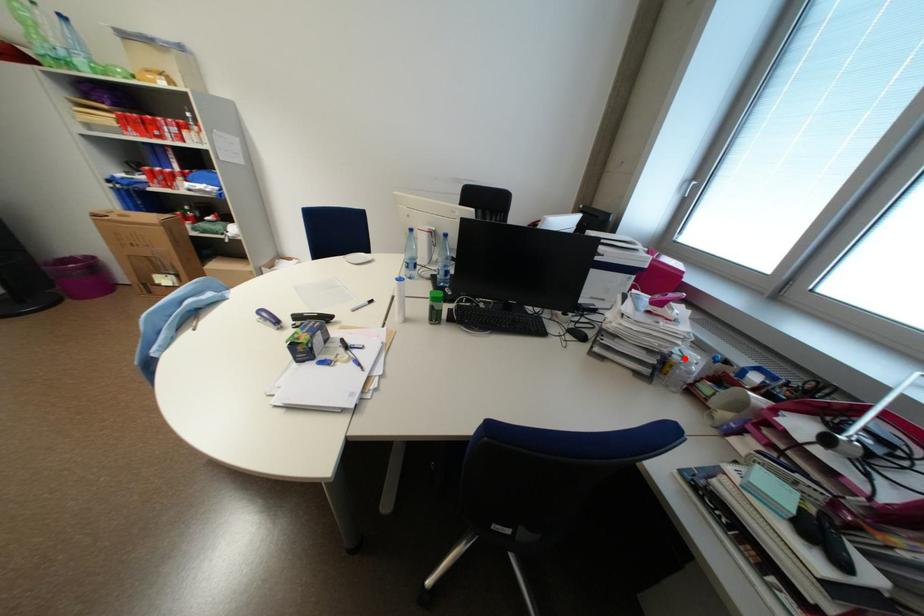
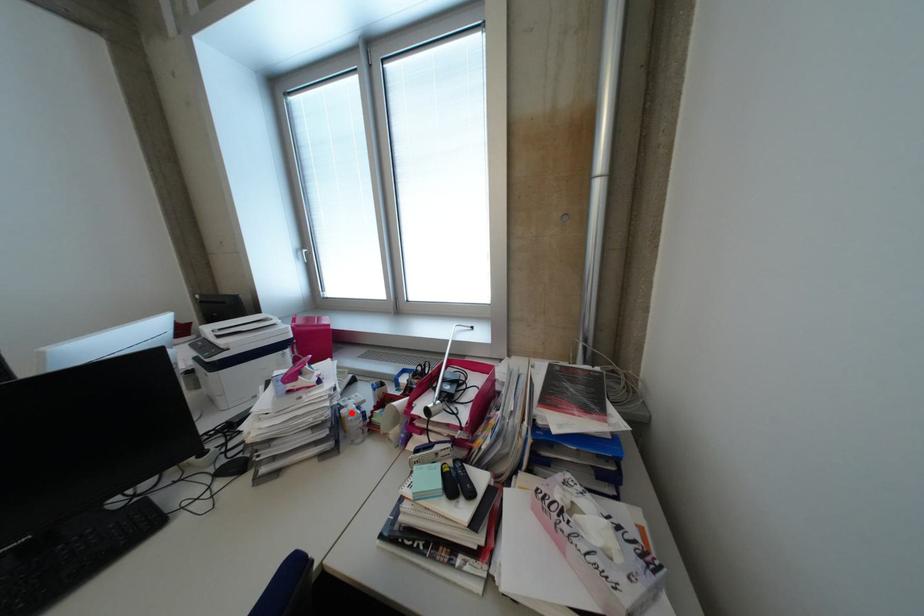
I am providing you with two images of the same scene from different viewpoints. A red point is marked on the first image and another point is marked on the second image. Is the red point in image1 aligned with the point shown in image2?

Yes